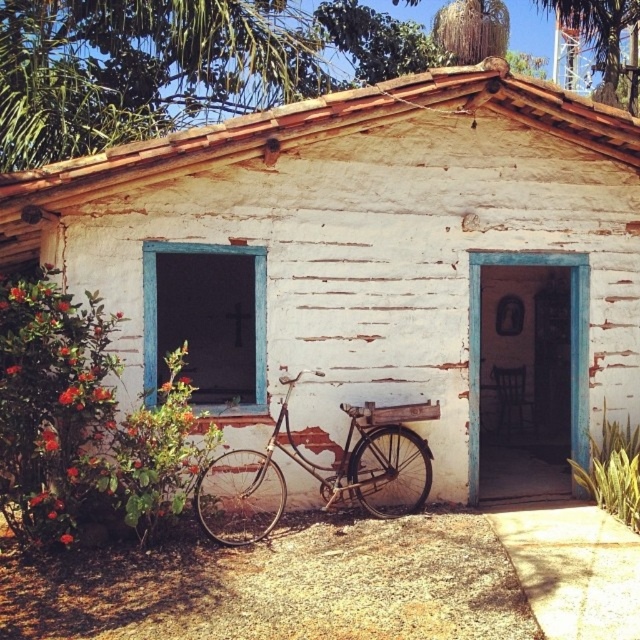
Question: Which of the following is the farthest from the observer?

Choices:
 (A) white weathered wood hut at center
 (B) rusty metal bicycle at lower left

Answer: (A)

Question: Can you confirm if white weathered wood hut at center is positioned to the right of rusty metal bicycle at lower left?

Choices:
 (A) yes
 (B) no

Answer: (B)

Question: Can you confirm if white weathered wood hut at center is positioned to the left of rusty metal bicycle at lower left?

Choices:
 (A) no
 (B) yes

Answer: (B)

Question: Which of the following is the farthest from the observer?

Choices:
 (A) (353, 433)
 (B) (458, 260)

Answer: (B)

Question: Is white weathered wood hut at center wider than rusty metal bicycle at lower left?

Choices:
 (A) no
 (B) yes

Answer: (A)